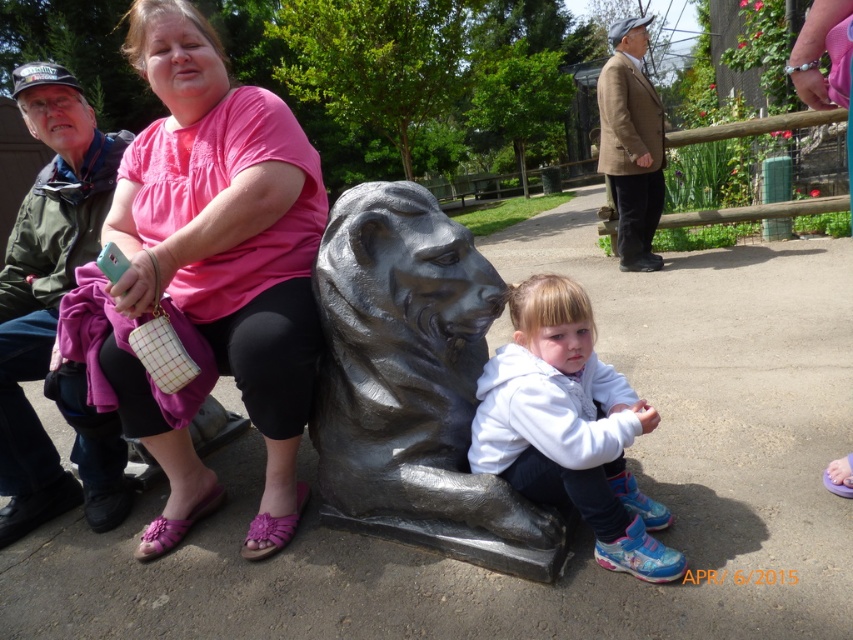
Question: Which object is positioned farthest from the white fleece jacket at center?

Choices:
 (A) pink fabric shirt at upper left
 (B) polished bronze lion at center

Answer: (A)

Question: Does pink fabric shirt at upper left have a greater width compared to polished bronze lion at center?

Choices:
 (A) yes
 (B) no

Answer: (A)

Question: Is pink fabric shirt at upper left to the right of polished bronze lion at center from the viewer's perspective?

Choices:
 (A) yes
 (B) no

Answer: (B)

Question: Which object appears farthest from the camera in this image?

Choices:
 (A) pink fabric shirt at upper left
 (B) polished bronze lion at center

Answer: (A)

Question: Considering the relative positions of polished bronze lion at center and white fleece jacket at center in the image provided, where is polished bronze lion at center located with respect to white fleece jacket at center?

Choices:
 (A) above
 (B) below

Answer: (A)

Question: Which point appears closest to the camera in this image?

Choices:
 (A) (548, 452)
 (B) (451, 529)

Answer: (A)